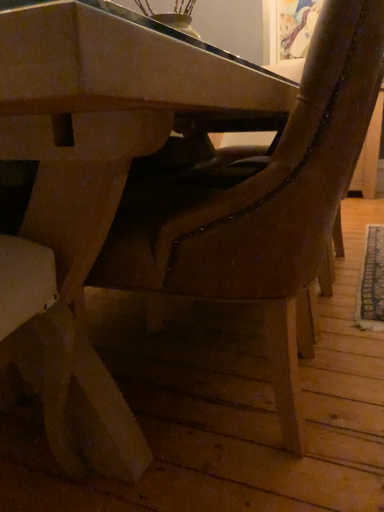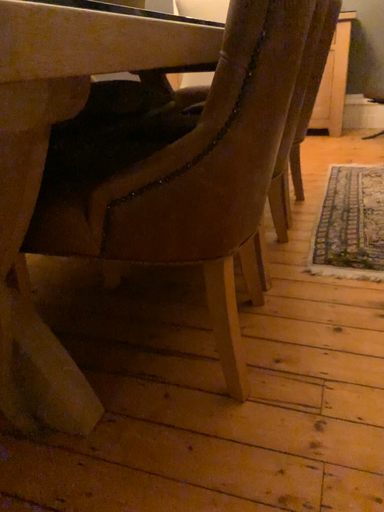
Question: Which way did the camera rotate in the video?

Choices:
 (A) rotated downward
 (B) rotated upward

Answer: (A)